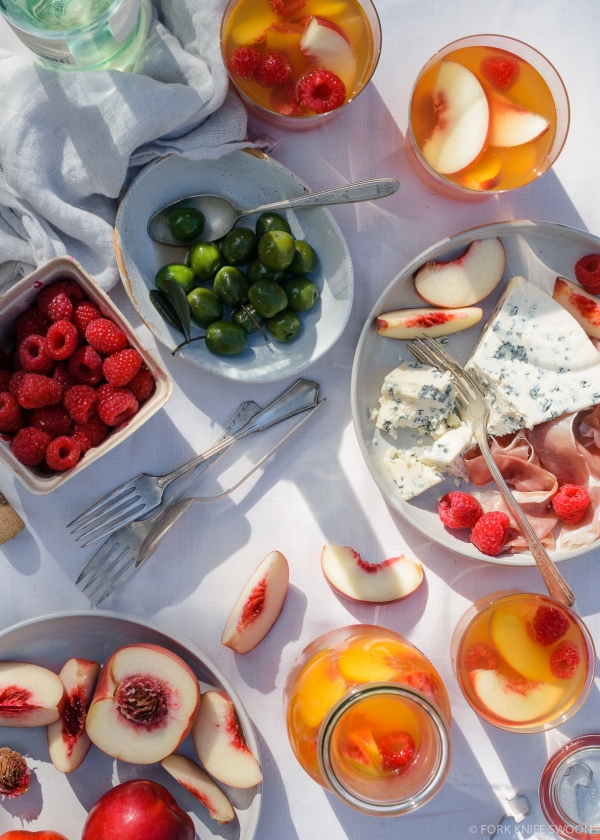
Locate an element on the screen. The height and width of the screenshot is (840, 600). fork is located at coordinates (93, 564), (103, 501), (456, 405).